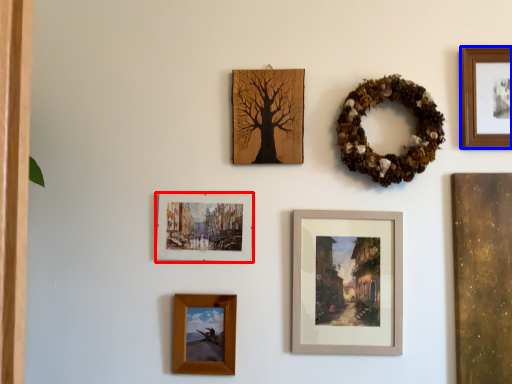
Question: Which object appears farthest to the camera in this image, picture frame (highlighted by a red box) or picture frame (highlighted by a blue box)?

Choices:
 (A) picture frame
 (B) picture frame

Answer: (A)